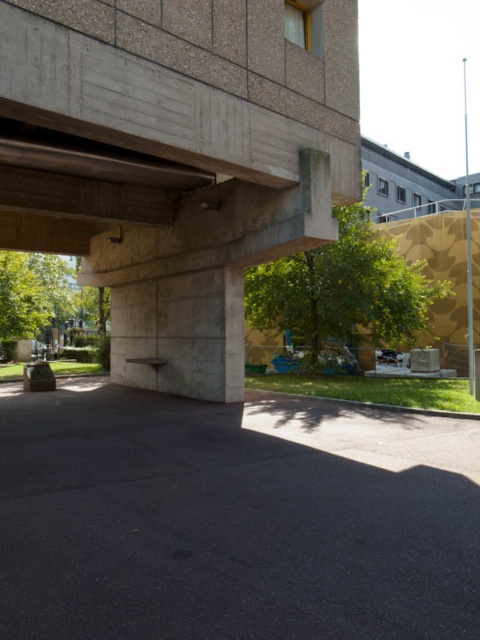
You are an urban planner reviewing this area and need to assess the space between the gray concrete at center and the concrete at upper left. Which of these two objects is smaller in size?

The gray concrete at center has a smaller size compared to the concrete at upper left, so the gray concrete at center is the smaller one.

You are standing in front of the urban structure and want to take a photo. There are two points of interest marked as point 1 at coordinates point (80, 388) and point 2 at coordinates point (343, 96). Which point should you focus on first if you want to capture the closest object to your camera in the scene?

Point 1 at coordinates point (80, 388) is closer to the camera than point 2 at coordinates point (343, 96), so you should focus on point 1 first to capture the closest object.

You are a construction worker assessing the height of the gray concrete at center and the concrete at upper left. Which one is taller?

The concrete at upper left is taller than the gray concrete at center.